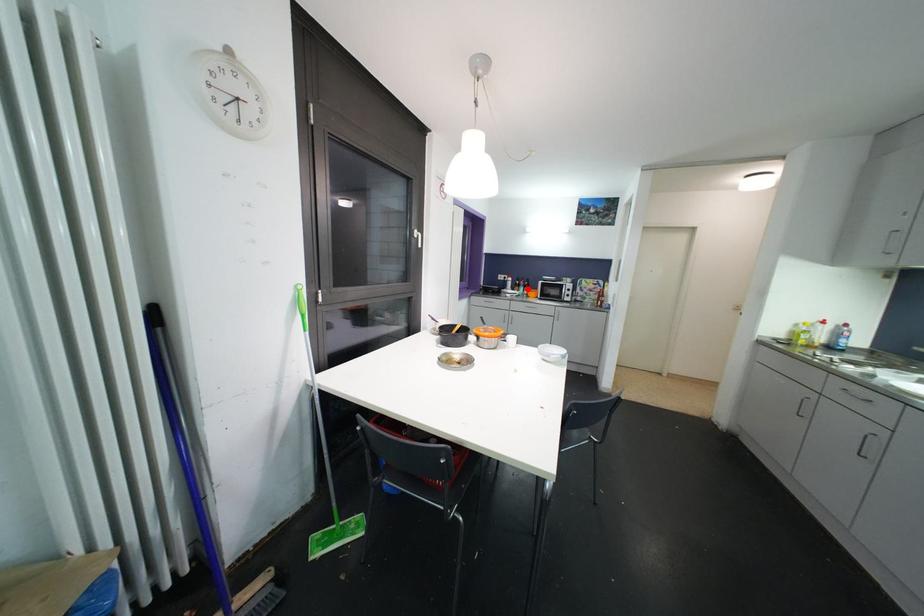
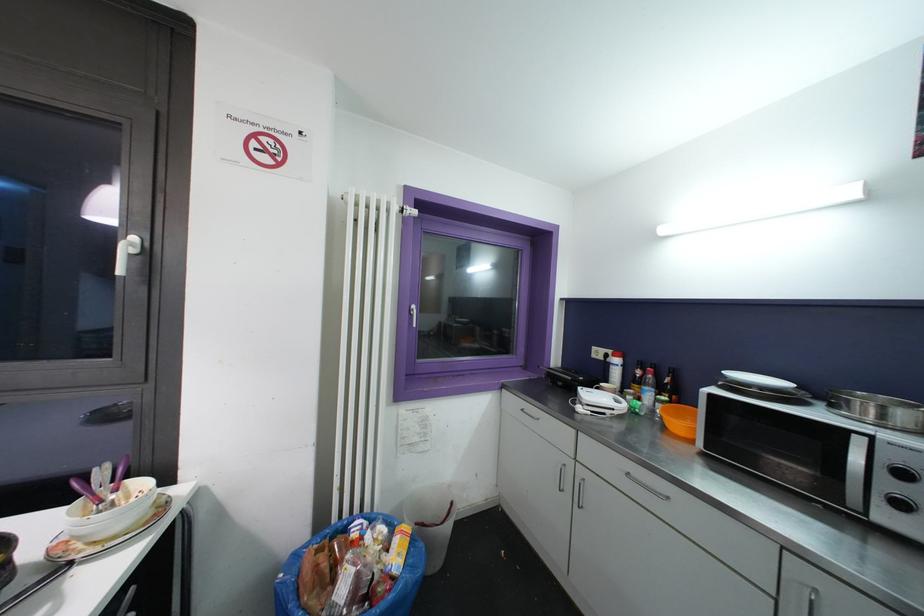
In the second image, find the point that corresponds to the highlighted location in the first image.

(663, 392)